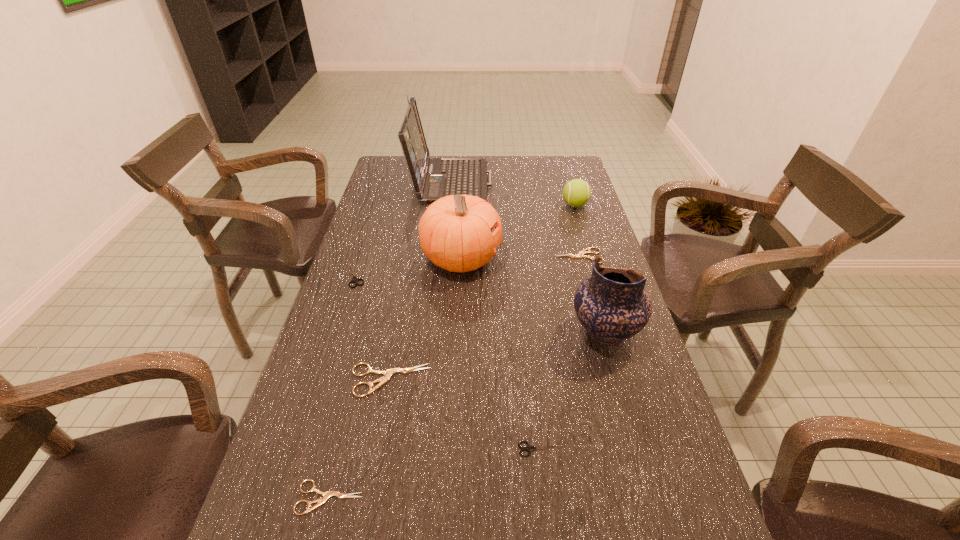
You are a GUI agent. You are given a task and a screenshot of the screen. Output one action in this format:
    pyautogui.click(x=<x>, y=<y>)
    Task: Click on the free space that is in between the orange pumpkin and the blue pottery
    The width and height of the screenshot is (960, 540).
    Given the screenshot: What is the action you would take?
    pyautogui.click(x=533, y=296)

This screenshot has width=960, height=540. I want to click on the third closest object to the sixth object from left to right, so click(x=326, y=495).

Locate which object is the third closest to the second nearest beige shears. Please provide its 2D coordinates. Your answer should be formatted as a tuple, i.e. [(x, y)], where the tuple contains the x and y coordinates of a point satisfying the conditions above.

[(355, 280)]

Identify which shears is the fifth closest to the tennis ball. Please provide its 2D coordinates. Your answer should be formatted as a tuple, i.e. [(x, y)], where the tuple contains the x and y coordinates of a point satisfying the conditions above.

[(326, 495)]

Identify which shears is located as the third nearest to the nearest object. Please provide its 2D coordinates. Your answer should be formatted as a tuple, i.e. [(x, y)], where the tuple contains the x and y coordinates of a point satisfying the conditions above.

[(355, 280)]

Point out which beige shears is positioned as the nearest to the orange pumpkin. Please provide its 2D coordinates. Your answer should be formatted as a tuple, i.e. [(x, y)], where the tuple contains the x and y coordinates of a point satisfying the conditions above.

[(581, 254)]

Locate which beige shears is the closest to the orange pumpkin. Please provide its 2D coordinates. Your answer should be formatted as a tuple, i.e. [(x, y)], where the tuple contains the x and y coordinates of a point satisfying the conditions above.

[(581, 254)]

Where is `free space that satisfies the following two spatial constraints: 1. on the front-facing side of the tallest object; 2. on the front side of the nearest beige shears`? This screenshot has height=540, width=960. free space that satisfies the following two spatial constraints: 1. on the front-facing side of the tallest object; 2. on the front side of the nearest beige shears is located at coordinates pyautogui.click(x=419, y=497).

Find the location of a particular element. free space that satisfies the following two spatial constraints: 1. on the back side of the seventh farthest object; 2. on the right side of the sixth farthest object is located at coordinates (398, 333).

Locate an element on the screen. vacant area that satisfies the following two spatial constraints: 1. on the front-facing side of the smaller black shears; 2. on the right side of the orange pumpkin is located at coordinates (451, 449).